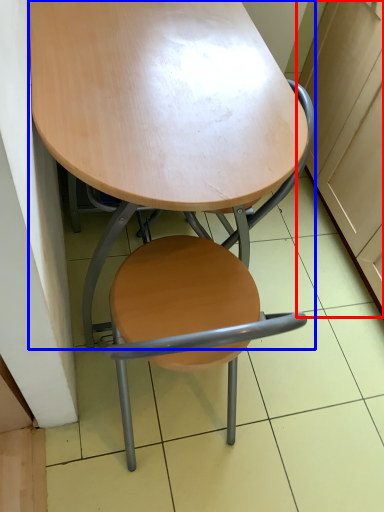
Question: Which object is closer to the camera taking this photo, cabinetry (highlighted by a red box) or table (highlighted by a blue box)?

Choices:
 (A) cabinetry
 (B) table

Answer: (B)